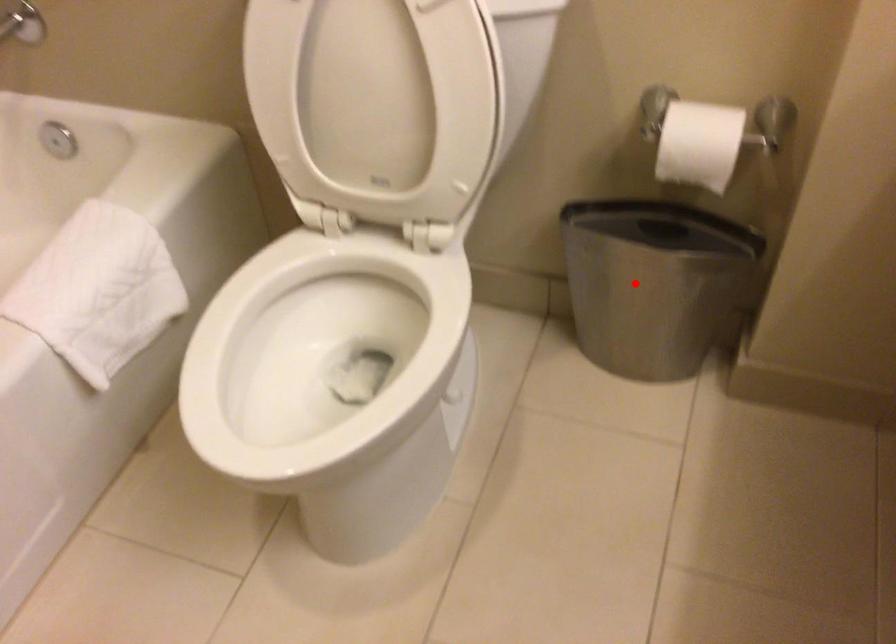
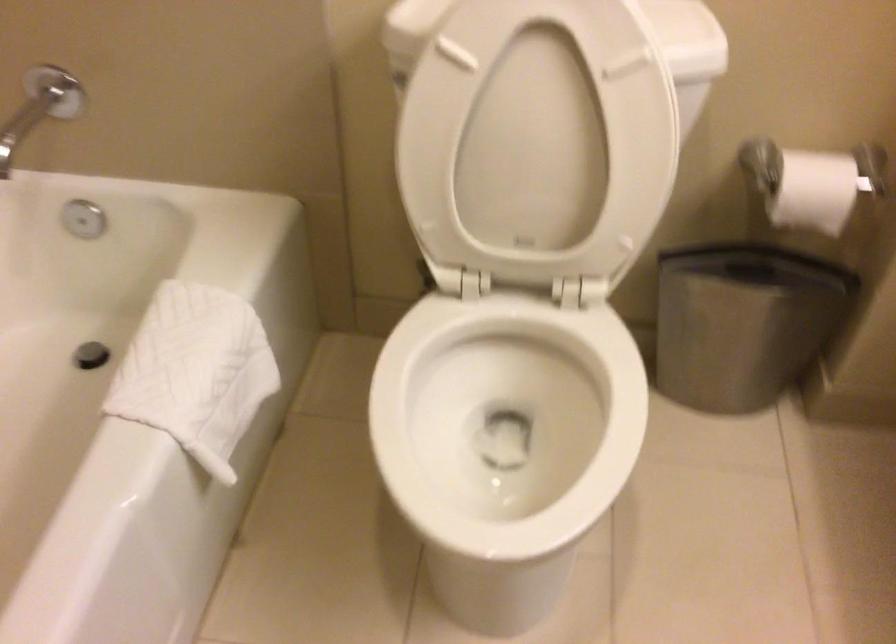
Locate, in the second image, the point that corresponds to the highlighted location in the first image.

(743, 323)